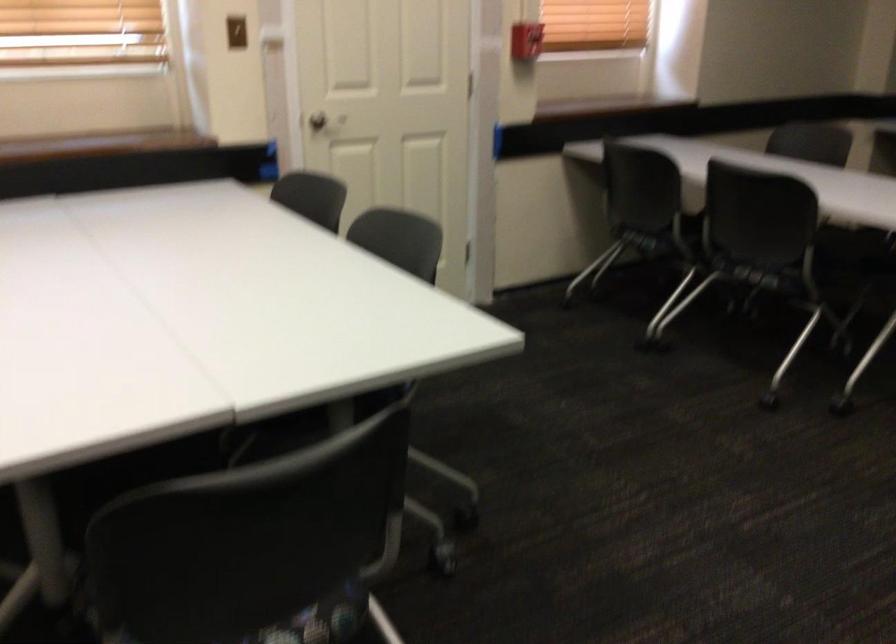
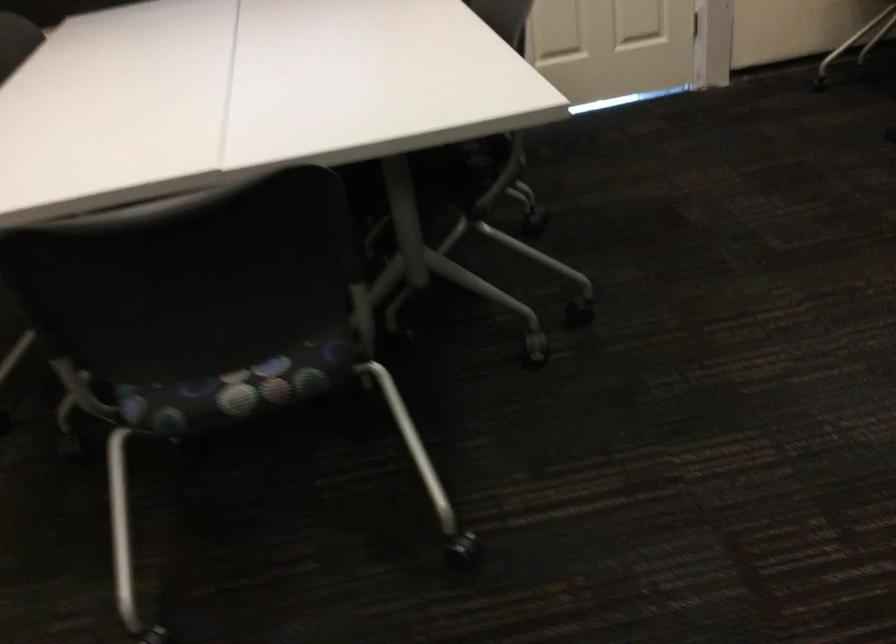
Which direction would the cameraman need to move to produce the second image?

The cameraman moved toward right, forward.